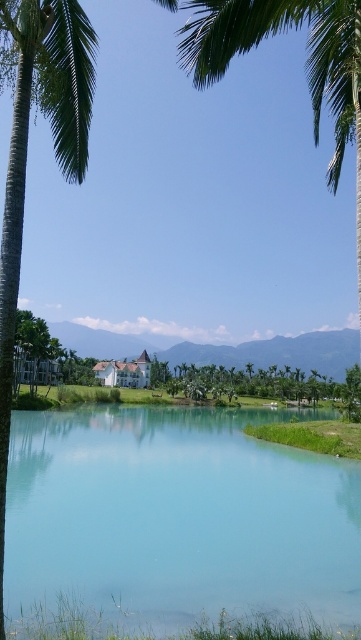
Question: Does green leafy palm tree at left have a smaller size compared to green leafy tree at center?

Choices:
 (A) yes
 (B) no

Answer: (A)

Question: Among these objects, which one is nearest to the camera?

Choices:
 (A) clear blue water at center
 (B) green leafy palm tree at left

Answer: (B)

Question: Considering the relative positions of clear blue water at center and green leafy tree at center in the image provided, where is clear blue water at center located with respect to green leafy tree at center?

Choices:
 (A) left
 (B) right

Answer: (A)

Question: Which object is the farthest from the green leafy palm tree at left?

Choices:
 (A) clear blue water at center
 (B) green leafy tree at center

Answer: (B)

Question: Estimate the real-world distances between objects in this image. Which object is farther from the green leafy tree at center?

Choices:
 (A) clear blue water at center
 (B) green leafy palm tree at left

Answer: (B)

Question: Is clear blue water at center positioned before green leafy tree at center?

Choices:
 (A) no
 (B) yes

Answer: (B)